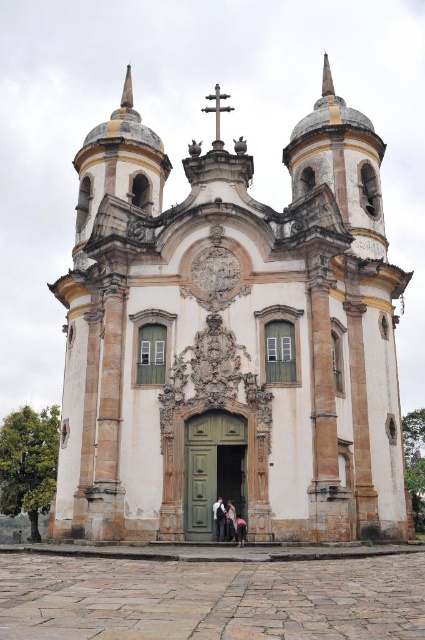
Does dark blue fabric at center come behind light pink fabric at center?

Yes, it is behind light pink fabric at center.

Is point (220, 508) positioned behind point (229, 515)?

Yes, it is behind point (229, 515).

Image resolution: width=425 pixels, height=640 pixels. What do you see at coordinates (218, 518) in the screenshot?
I see `dark blue fabric at center` at bounding box center [218, 518].

Identify the location of dark blue fabric at center. (218, 518).

Measure the distance from white stone church at center to light pink fabric at center.

white stone church at center and light pink fabric at center are 84.79 feet apart.

Is point (67, 316) less distant than point (229, 531)?

No, (67, 316) is behind (229, 531).

What do you see at coordinates (231, 339) in the screenshot? This screenshot has width=425, height=640. I see `white stone church at center` at bounding box center [231, 339].

At what (x,y) coordinates should I click in order to perform the action: click on white stone church at center. Please return your answer as a coordinate pair (x, y). Image resolution: width=425 pixels, height=640 pixels. Looking at the image, I should click on (231, 339).

Between point (226, 529) and point (235, 520), which one is positioned in front?

Point (235, 520) is more forward.

The width and height of the screenshot is (425, 640). In order to click on light pink fabric at center in this screenshot , I will do `click(229, 520)`.